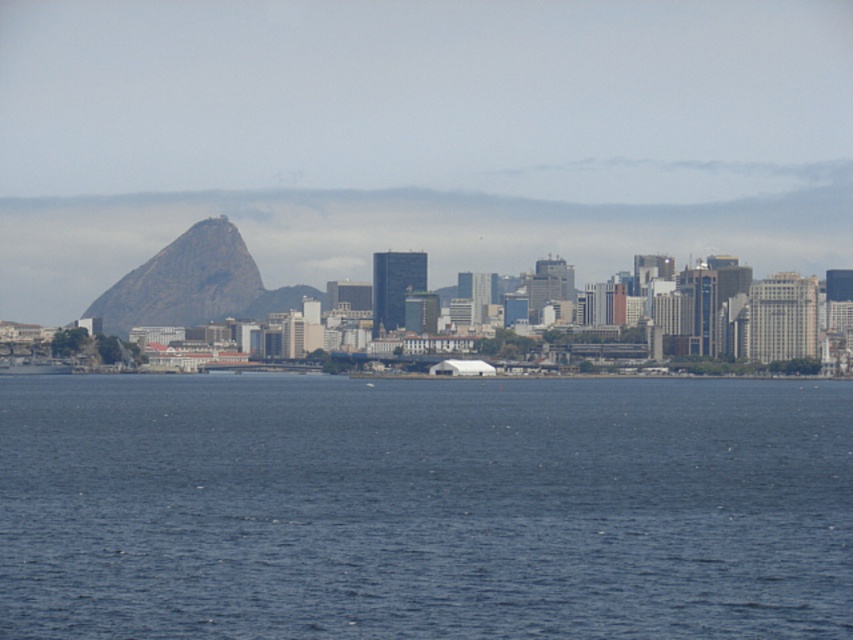
You are a photographer planning to capture the entire view of the coastal cityscape. Given that your camera can only focus on objects up to a certain height, which object between the blue water at center and the rocky gray mountain at left would be more likely to be in focus if you prioritize the taller one?

The blue water at center is taller than the rocky gray mountain at left, so prioritizing the taller object, the blue water at center would be more likely to be in focus.

You are a tourist planning to take a photo of the blue water at center and the rocky gray mountain at left. Which object should you focus on first if you want to capture both in one frame without moving the camera?

The blue water at center is larger in size compared to the rocky gray mountain at left, so you should focus on the blue water at center first to ensure it fills the frame appropriately before adjusting for the mountain.

You are a tourist standing on a balcony overlooking the city. You see the blue water at center and the rocky gray mountain at left. Which object is closer to your viewpoint?

The blue water at center is closer to your viewpoint because it is positioned below the rocky gray mountain at left, indicating it is in the foreground of the scene.